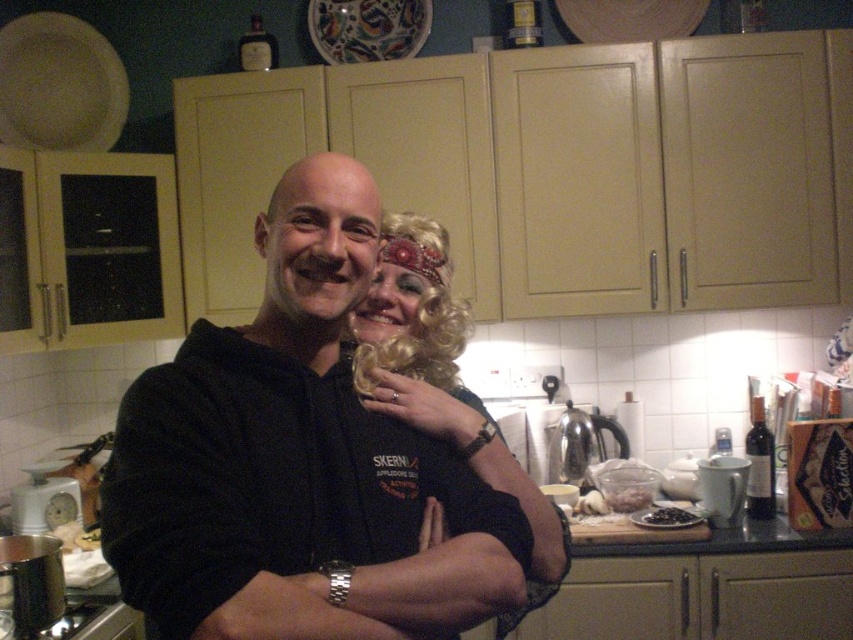
Does black matte hoodie at center have a smaller size compared to black fabric arm at center?

No.

Does black matte hoodie at center appear over black fabric arm at center?

Correct, black matte hoodie at center is located above black fabric arm at center.

Is point (450, 474) less distant than point (408, 388)?

Yes, it is.

This screenshot has width=853, height=640. Find the location of `black matte hoodie at center`. black matte hoodie at center is located at coordinates (299, 464).

Can you confirm if black matte hoodie at center is bigger than blonde curly wig at center?

Indeed, black matte hoodie at center has a larger size compared to blonde curly wig at center.

Is point (315, 337) farther from viewer compared to point (397, 240)?

No, it is in front of (397, 240).

At what (x,y) coordinates should I click in order to perform the action: click on black matte hoodie at center. Please return your answer as a coordinate pair (x, y). Looking at the image, I should click on (299, 464).

Is blonde curly wig at center wider than black fabric arm at center?

No.

Which is in front, point (389, 276) or point (474, 432)?

Point (474, 432)

In order to click on blonde curly wig at center in this screenshot , I will do `click(410, 308)`.